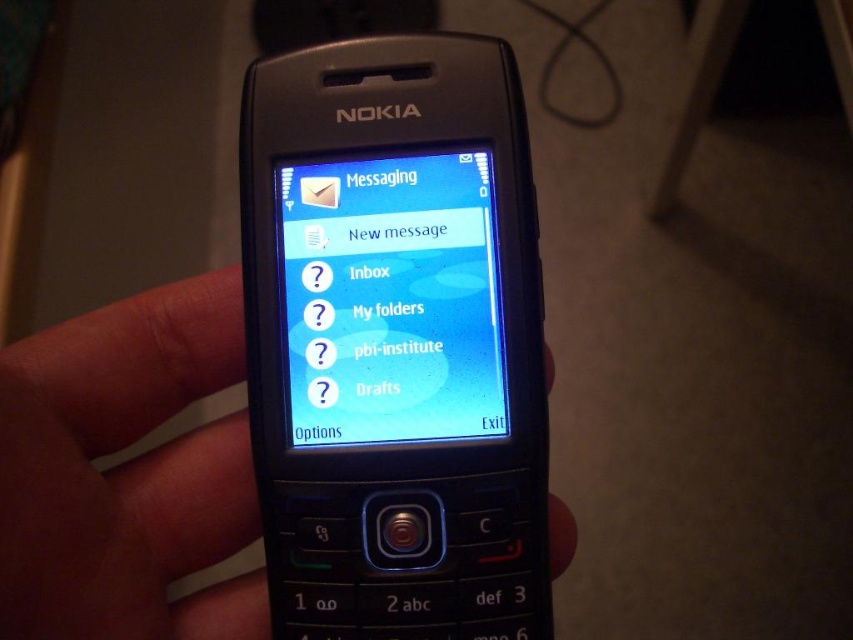
Question: Which of these objects is positioned closest to the blue glossy screen at center?

Choices:
 (A) black matte phone at center
 (B) black plastic phone at center

Answer: (B)

Question: Does black plastic phone at center have a greater width compared to blue glossy screen at center?

Choices:
 (A) yes
 (B) no

Answer: (A)

Question: Can you confirm if black plastic phone at center is positioned above black matte phone at center?

Choices:
 (A) no
 (B) yes

Answer: (B)

Question: Is black plastic phone at center smaller than blue glossy screen at center?

Choices:
 (A) yes
 (B) no

Answer: (B)

Question: Which object is closer to the camera taking this photo?

Choices:
 (A) blue glossy screen at center
 (B) black matte phone at center
 (C) black plastic phone at center

Answer: (B)

Question: Based on their relative distances, which object is nearer to the black plastic phone at center?

Choices:
 (A) blue glossy screen at center
 (B) black matte phone at center

Answer: (A)